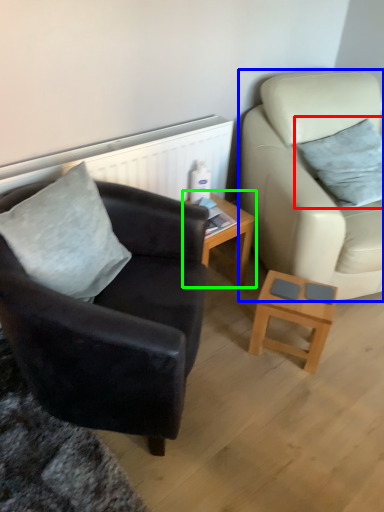
Question: Considering the real-world distances, which object is farthest from pillow (highlighted by a red box)? studio couch (highlighted by a blue box) or table (highlighted by a green box)?

Choices:
 (A) studio couch
 (B) table

Answer: (B)